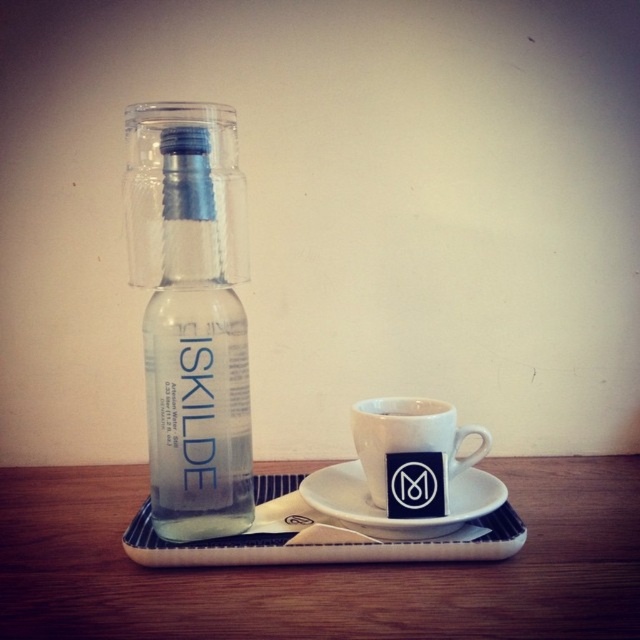
Question: Is white ceramic mug at lower center positioned before white ceramic saucer at center?

Choices:
 (A) no
 (B) yes

Answer: (A)

Question: Does clear glass bottle at left come behind white ceramic saucer at center?

Choices:
 (A) no
 (B) yes

Answer: (A)

Question: Which object appears closest to the camera in this image?

Choices:
 (A) wooden table at center
 (B) clear glass bottle at left
 (C) white ceramic saucer at center

Answer: (A)

Question: Which point is closer to the camera?

Choices:
 (A) (22, 589)
 (B) (454, 419)
 (C) (150, 157)
 (D) (358, 481)

Answer: (A)

Question: Which point appears farthest from the camera in this image?

Choices:
 (A) (472, 454)
 (B) (237, 600)
 (C) (342, 484)

Answer: (C)

Question: Where is white ceramic mug at lower center located in relation to white ceramic saucer at center in the image?

Choices:
 (A) below
 (B) above

Answer: (B)